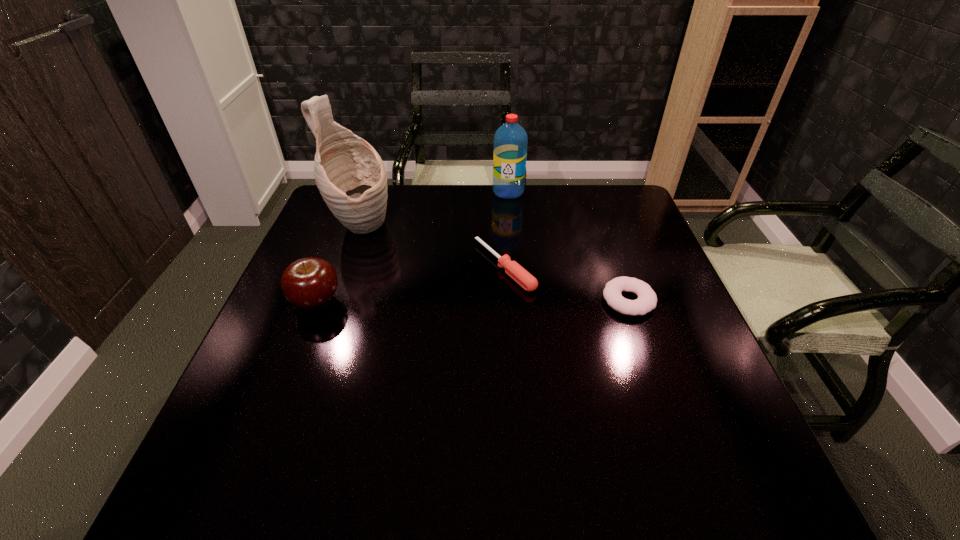
This screenshot has width=960, height=540. Find the location of `blank region between the farthest object and the rightmost object`. blank region between the farthest object and the rightmost object is located at coordinates (568, 246).

This screenshot has width=960, height=540. I want to click on vacant area that lies between the screwdriver and the pitcher, so (x=432, y=247).

Identify the location of empty location between the screwdriver and the farthest object. (506, 229).

This screenshot has height=540, width=960. I want to click on unoccupied area between the tallest object and the farthest object, so [434, 210].

The image size is (960, 540). I want to click on vacant point located between the doughnut and the apple, so click(x=472, y=301).

Locate an element on the screen. This screenshot has width=960, height=540. vacant space that's between the tallest object and the screwdriver is located at coordinates (432, 247).

The image size is (960, 540). I want to click on vacant space that is in between the screwdriver and the rightmost object, so click(566, 284).

Identify the location of empty space between the tallest object and the rightmost object. The image size is (960, 540). (493, 264).

Identify the location of free space between the tallest object and the third tallest object. The image size is (960, 540). (338, 265).

The height and width of the screenshot is (540, 960). I want to click on vacant area that lies between the screwdriver and the farthest object, so click(506, 229).